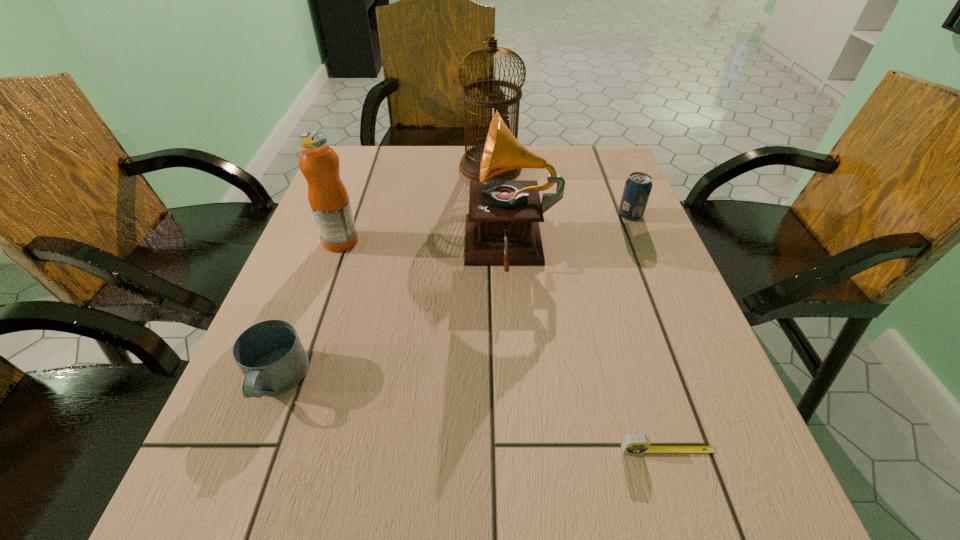
You are a GUI agent. You are given a task and a screenshot of the screen. Output one action in this format:
    pyautogui.click(x=<x>, y=<y>)
    Task: Click on the farthest object
    Image resolution: width=960 pixels, height=540 pixels.
    Given the screenshot: What is the action you would take?
    pyautogui.click(x=469, y=165)

The image size is (960, 540). Find the location of `phonograph record`. phonograph record is located at coordinates (502, 228).

This screenshot has height=540, width=960. I want to click on the fourth shortest object, so click(x=328, y=197).

Identify the location of the third shortest object. (637, 189).

Identify the location of the fifth tallest object. (270, 355).

This screenshot has height=540, width=960. I want to click on the second nearest object, so 270,355.

Identify the location of the shortest object. The image size is (960, 540). (638, 443).

Image resolution: width=960 pixels, height=540 pixels. Find the location of `the nearest object`. the nearest object is located at coordinates (638, 443).

This screenshot has height=540, width=960. Identify the location of vacant area located 0.180m on the front-facing side of the birdcage. (396, 167).

Where is `free space located on the front-facing side of the birdcage`? The height and width of the screenshot is (540, 960). free space located on the front-facing side of the birdcage is located at coordinates (375, 167).